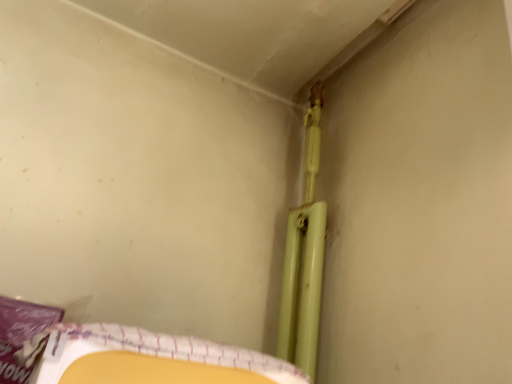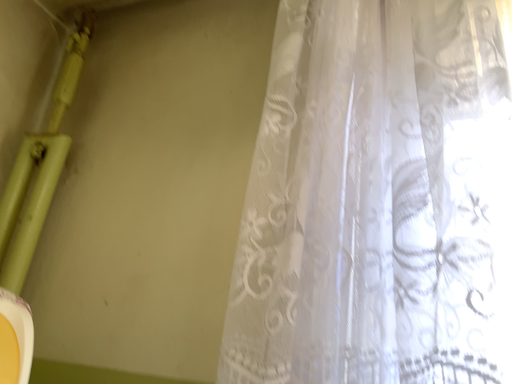
Question: Which way did the camera rotate in the video?

Choices:
 (A) rotated left
 (B) rotated right

Answer: (B)